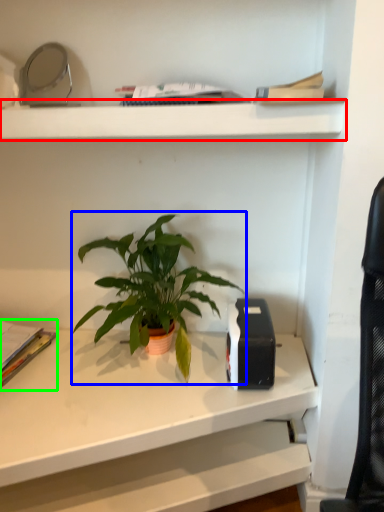
Question: Estimate the real-world distances between objects in this image. Which object is closer to shelf (highlighted by a red box), houseplant (highlighted by a blue box) or paperback book (highlighted by a green box)?

Choices:
 (A) houseplant
 (B) paperback book

Answer: (A)